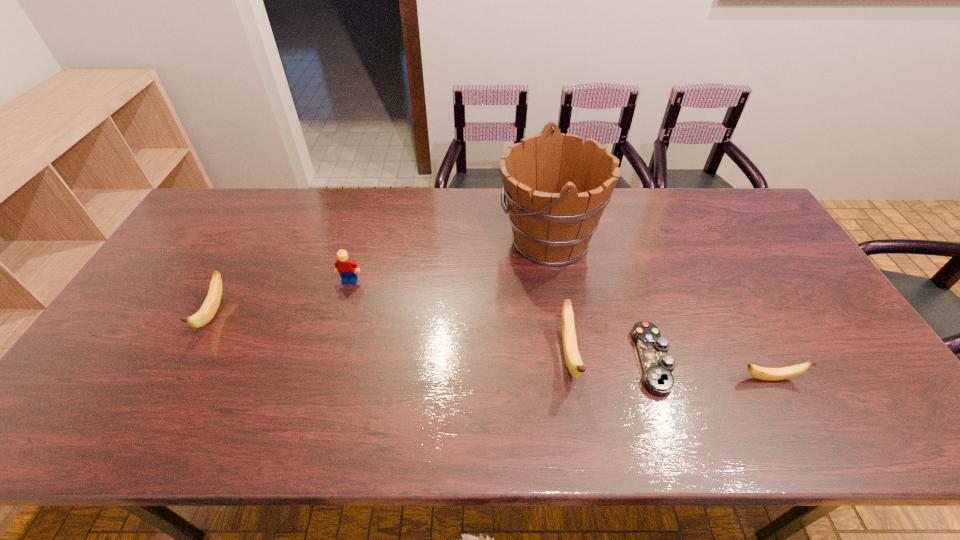
Where is `vacant space positioned 0.100m at the stem of the rightmost object`? vacant space positioned 0.100m at the stem of the rightmost object is located at coordinates (842, 379).

I want to click on vacant space located with the handle on the wine bucket, so click(401, 239).

Identify the location of vacant area situated with the handle on the wine bucket. The width and height of the screenshot is (960, 540). (389, 239).

Find the location of a particular element. The image size is (960, 540). free spot located 0.110m with the handle on the wine bucket is located at coordinates (463, 239).

I want to click on vacant space located 0.310m on the front-facing side of the second object from left to right, so click(323, 376).

Where is `blank space located on the left of the shortest object`? This screenshot has width=960, height=540. blank space located on the left of the shortest object is located at coordinates (580, 360).

Where is `object that is at the far edge`? This screenshot has height=540, width=960. object that is at the far edge is located at coordinates (556, 190).

This screenshot has height=540, width=960. I want to click on control at the near edge, so click(658, 366).

You are a GUI agent. You are given a task and a screenshot of the screen. Output one action in this format:
    pyautogui.click(x=<x>, y=<y>)
    Task: Click on the vacant space at the far edge of the desktop
    The image size is (960, 540).
    Given the screenshot: What is the action you would take?
    pyautogui.click(x=464, y=230)

What are the coordinates of `vacant space at the near edge` in the screenshot? It's located at (605, 369).